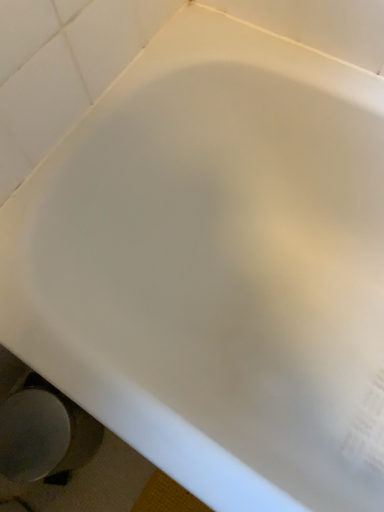
From the picture: What is the approximate width of satin silver bidet at lower left?

satin silver bidet at lower left is 8.68 inches wide.

Describe the element at coordinates (44, 435) in the screenshot. I see `satin silver bidet at lower left` at that location.

Image resolution: width=384 pixels, height=512 pixels. Find the location of `satin silver bidet at lower left`. satin silver bidet at lower left is located at coordinates (44, 435).

Identify the location of satin silver bidet at lower left. The image size is (384, 512). (44, 435).